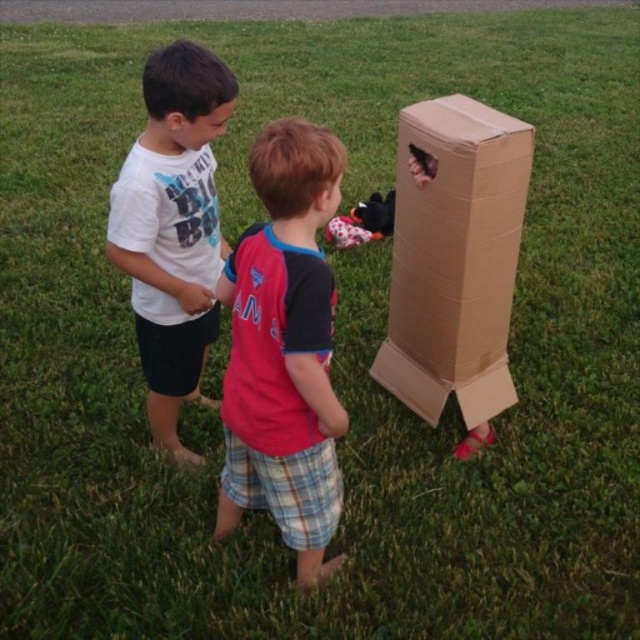
You are a child trying to decide which item to play with first. The brown cardboard box at right and the black plush toy at center are both in front of you. Which one is larger in size?

The brown cardboard box at right is bigger than the black plush toy at center, so you should choose the brown cardboard box at right first if you prefer larger items.

You are a photographer trying to capture a photo of the two points in the image. Which point, point (310, 257) or point (332, 221), will appear larger in the photo?

Point (310, 257) is closer to the camera than point (332, 221), so it will appear larger in the photo.

You are a photographer trying to capture a clear photo of the white cotton shirt at center without the black plush toy at center blocking it. Based on their positions, can you adjust your camera angle to achieve this?

The white cotton shirt at center is in front of the black plush toy at center, so adjusting the camera angle to focus on the white cotton shirt at center while avoiding the area behind it would allow you to capture a clear photo without the black plush toy at center blocking the view.